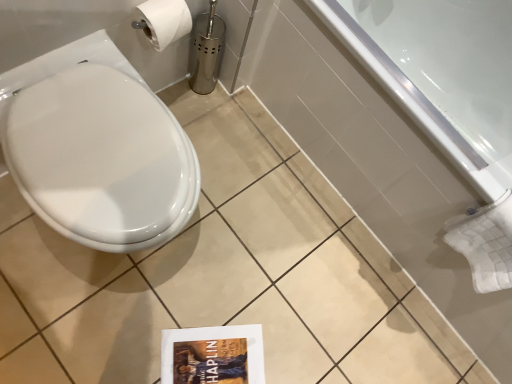
Question: In terms of width, does white glossy bathtub at upper right look wider or thinner when compared to white glossy toilet at left?

Choices:
 (A) thin
 (B) wide

Answer: (B)

Question: Is white glossy bathtub at upper right taller or shorter than white glossy toilet at left?

Choices:
 (A) tall
 (B) short

Answer: (A)

Question: From a real-world perspective, relative to white glossy toilet at left, is white glossy bathtub at upper right vertically above or below?

Choices:
 (A) above
 (B) below

Answer: (B)

Question: Considering the positions of point (133, 243) and point (329, 91), is point (133, 243) closer or farther from the camera than point (329, 91)?

Choices:
 (A) farther
 (B) closer

Answer: (B)

Question: Would you say white glossy toilet at left is inside or outside white glossy bathtub at upper right?

Choices:
 (A) inside
 (B) outside

Answer: (B)

Question: Is white glossy toilet at left taller or shorter than white glossy bathtub at upper right?

Choices:
 (A) tall
 (B) short

Answer: (B)

Question: In the image, is white glossy toilet at left on the left side or the right side of white glossy bathtub at upper right?

Choices:
 (A) right
 (B) left

Answer: (B)